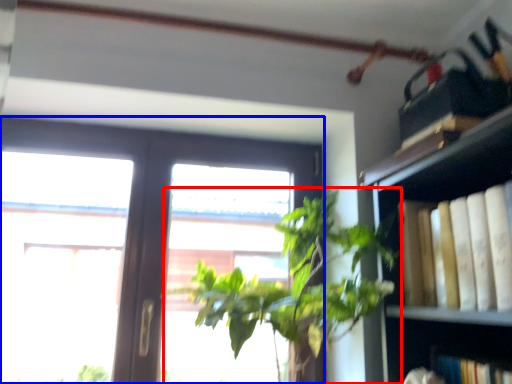
Question: Which of the following is the closest to the observer, houseplant (highlighted by a red box) or window (highlighted by a blue box)?

Choices:
 (A) houseplant
 (B) window

Answer: (A)